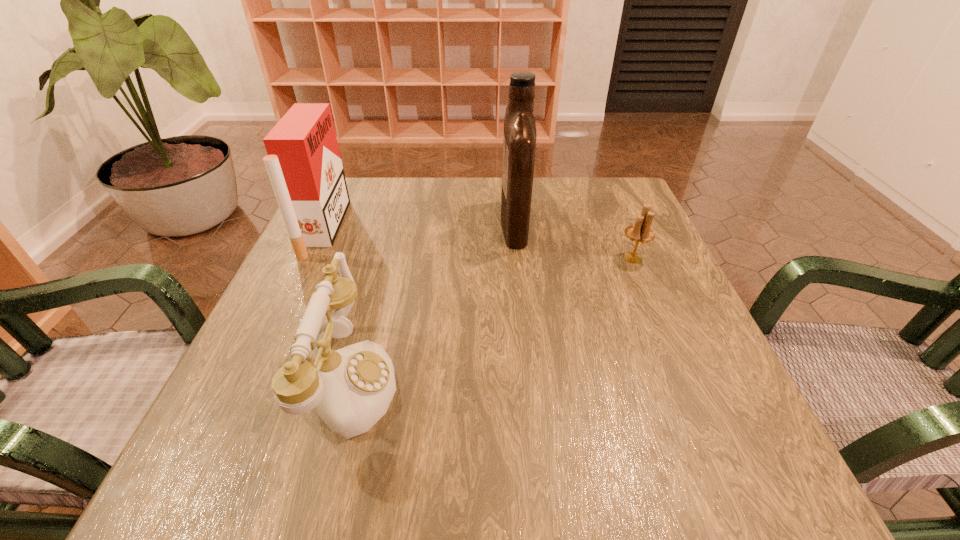
Locate an element on the screen. the tallest object is located at coordinates (519, 141).

You are a GUI agent. You are given a task and a screenshot of the screen. Output one action in this format:
    pyautogui.click(x=<x>, y=<y>)
    Task: Click on the third object from left to right
    This screenshot has height=540, width=960.
    Given the screenshot: What is the action you would take?
    pyautogui.click(x=519, y=141)

You are a GUI agent. You are given a task and a screenshot of the screen. Output one action in this format:
    pyautogui.click(x=<x>, y=<y>)
    Task: Click on the leftmost object
    The height and width of the screenshot is (540, 960).
    Given the screenshot: What is the action you would take?
    [x=304, y=165]

Locate an element on the screen. The image size is (960, 540). cigarette case is located at coordinates (304, 165).

You are a GUI agent. You are given a task and a screenshot of the screen. Output one action in this format:
    pyautogui.click(x=<x>, y=<y>)
    Task: Click on the telephone
    The width and height of the screenshot is (960, 540).
    Given the screenshot: What is the action you would take?
    pyautogui.click(x=352, y=387)

The image size is (960, 540). What are the coordinates of `the third object from right to left` in the screenshot? It's located at (352, 387).

At what (x,y) coordinates should I click in order to perform the action: click on the shortest object. Please return your answer as a coordinate pair (x, y). This screenshot has width=960, height=540. Looking at the image, I should click on (640, 232).

In order to click on candle holder in this screenshot , I will do `click(640, 232)`.

You are a GUI agent. You are given a task and a screenshot of the screen. Output one action in this format:
    pyautogui.click(x=<x>, y=<y>)
    Task: Click on the vacant point located on the label side of the third object from left to right
    This screenshot has width=960, height=540.
    Given the screenshot: What is the action you would take?
    pyautogui.click(x=409, y=223)

Identify the location of free point located on the label side of the third object from left to right. This screenshot has width=960, height=540. (421, 223).